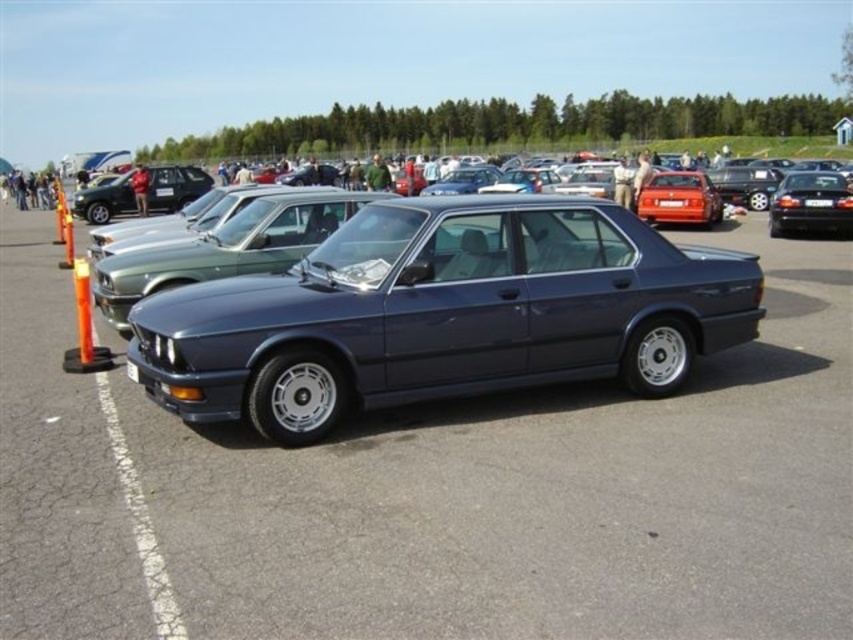
Can you confirm if metallic silver sedan at center is taller than orange plastic cone at left?

Yes, metallic silver sedan at center is taller than orange plastic cone at left.

Can you confirm if metallic silver sedan at center is bigger than orange plastic cone at left?

Indeed, metallic silver sedan at center has a larger size compared to orange plastic cone at left.

This screenshot has height=640, width=853. I want to click on metallic silver sedan at center, so [x=175, y=186].

Find the location of a particular element. This screenshot has width=853, height=640. satin dark blue sedan at center is located at coordinates (444, 314).

Is satin dark blue sedan at center taller than shiny red sedan at center?

Indeed, satin dark blue sedan at center has a greater height compared to shiny red sedan at center.

I want to click on satin dark blue sedan at center, so click(x=444, y=314).

Identify the location of satin dark blue sedan at center. This screenshot has width=853, height=640. (444, 314).

Which is more to the left, metallic silver sedan at center or shiny red sedan at center?

Positioned to the left is metallic silver sedan at center.

Between point (206, 177) and point (679, 186), which one is positioned behind?

Point (206, 177)

Find the location of a particular element. metallic silver sedan at center is located at coordinates (175, 186).